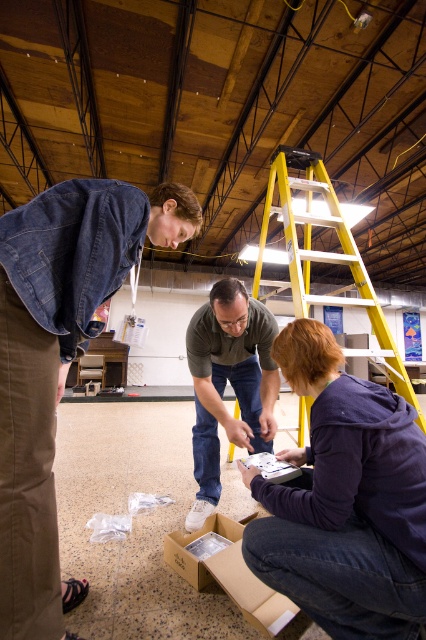
Does purple fleece jacket at lower center appear over brown cardboard box at lower center?

Yes.

Is purple fleece jacket at lower center in front of brown cardboard box at lower center?

That is True.

Between point (339, 476) and point (201, 534), which one is positioned in front?

Positioned in front is point (339, 476).

At what (x,y) coordinates should I click in order to perform the action: click on purple fleece jacket at lower center. Please return your answer as a coordinate pair (x, y). This screenshot has height=640, width=426. Looking at the image, I should click on (345, 500).

Between point (296, 592) and point (198, 428), which one is positioned behind?

Point (198, 428)

Is the position of purple fleece jacket at lower center more distant than that of matte gray shirt at center?

No, it is not.

Identify the location of purple fleece jacket at lower center. (345, 500).

Who is lower down, purple fleece jacket at lower center or yellow metallic ladder at upper center?

Positioned lower is purple fleece jacket at lower center.

Who is shorter, purple fleece jacket at lower center or yellow metallic ladder at upper center?

Standing shorter between the two is purple fleece jacket at lower center.

Where is `purple fleece jacket at lower center`? The height and width of the screenshot is (640, 426). purple fleece jacket at lower center is located at coordinates (345, 500).

At what (x,y) coordinates should I click in order to perform the action: click on purple fleece jacket at lower center. Please return your answer as a coordinate pair (x, y). Looking at the image, I should click on (345, 500).